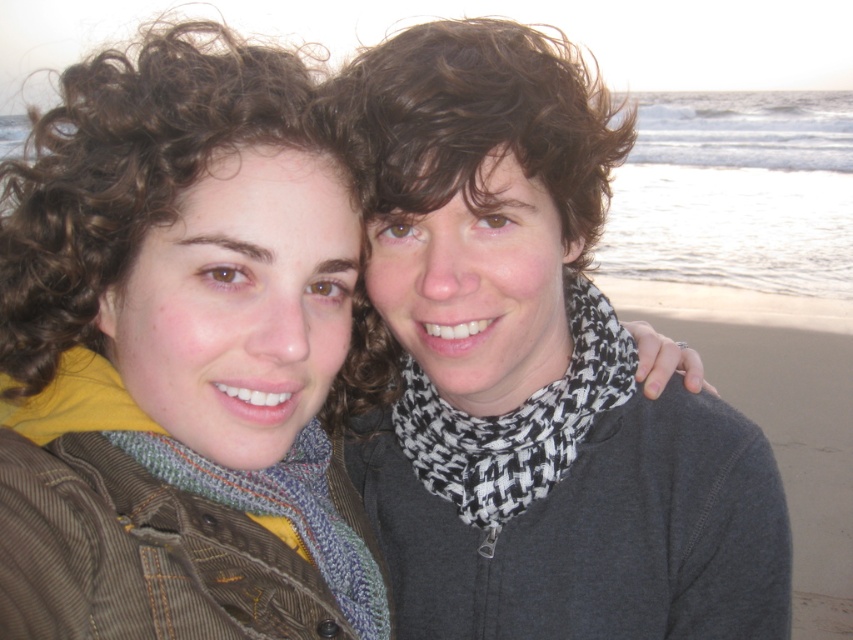
Does knitted scarf at center have a lesser height compared to black and white woven scarf at center?

Incorrect, knitted scarf at center's height does not fall short of black and white woven scarf at center's.

Is knitted scarf at center thinner than black and white woven scarf at center?

In fact, knitted scarf at center might be wider than black and white woven scarf at center.

Where is `knitted scarf at center`? The height and width of the screenshot is (640, 853). knitted scarf at center is located at coordinates (180, 355).

Identify the location of knitted scarf at center. (180, 355).

Between black and white woven scarf at center and knitted wool scarf at center, which one has less height?

knitted wool scarf at center

Is black and white woven scarf at center wider than knitted wool scarf at center?

Indeed, black and white woven scarf at center has a greater width compared to knitted wool scarf at center.

Image resolution: width=853 pixels, height=640 pixels. I want to click on black and white woven scarf at center, so [518, 420].

Is the position of knitted scarf at center more distant than that of knitted wool scarf at center?

No.

Can you confirm if knitted scarf at center is positioned below knitted wool scarf at center?

No, knitted scarf at center is not below knitted wool scarf at center.

Which is behind, point (146, 477) or point (361, 576)?

Point (361, 576)

Image resolution: width=853 pixels, height=640 pixels. I want to click on knitted scarf at center, so click(180, 355).